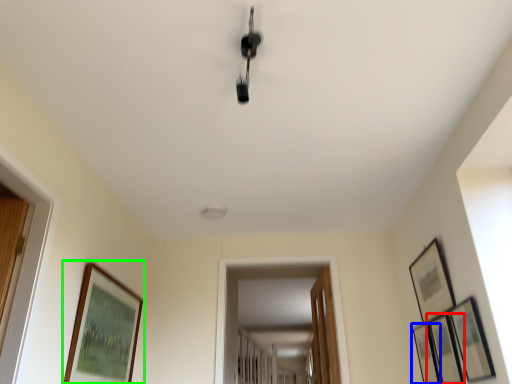
Question: Which object is the closest to the picture frame (highlighted by a red box)? Choose among these: picture frame (highlighted by a blue box) or picture frame (highlighted by a green box).

Choices:
 (A) picture frame
 (B) picture frame

Answer: (A)